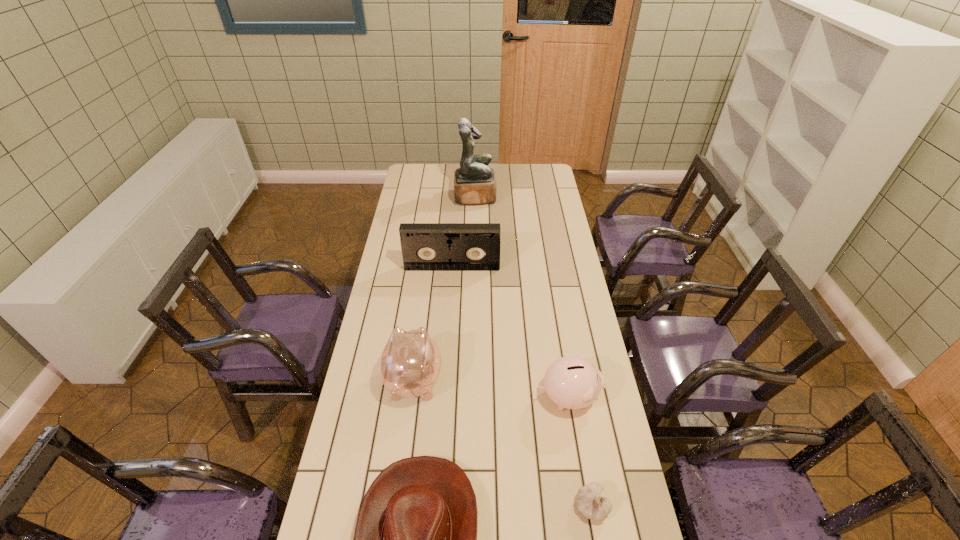
Locate an element on the screen. Image resolution: width=960 pixels, height=540 pixels. free space located 0.320m on the front facing side of the left piggy bank is located at coordinates (425, 287).

Find the location of `vacant region located on the front facing side of the left piggy bank`. vacant region located on the front facing side of the left piggy bank is located at coordinates (420, 339).

Identify the location of free location located on the back of the shorter piggy bank. (549, 292).

This screenshot has width=960, height=540. I want to click on vacant space located on the back of the garlic, so click(586, 469).

The height and width of the screenshot is (540, 960). I want to click on object present at the far edge, so click(474, 182).

Where is `videotape at the left edge`? Image resolution: width=960 pixels, height=540 pixels. videotape at the left edge is located at coordinates coord(425,246).

Identify the location of piggy bank at the left edge. (410, 363).

In order to click on piggy bank that is at the right edge in this screenshot , I will do `click(572, 382)`.

Identify the location of garlic at the right edge. The image size is (960, 540). (589, 502).

The width and height of the screenshot is (960, 540). In the image, there is a desktop. What are the coordinates of `vacant area at the far edge` in the screenshot? It's located at [x=500, y=172].